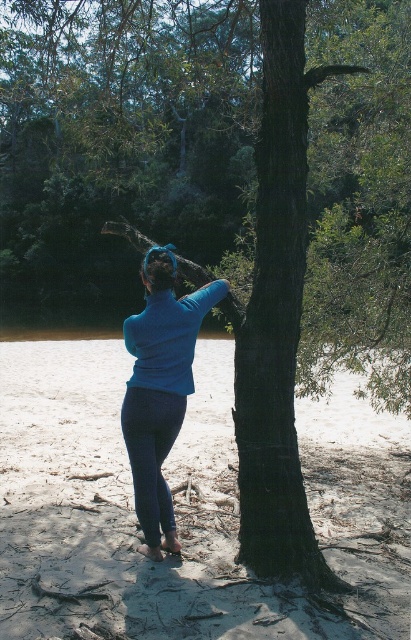
Is sandy textured sand at center thinner than blue matte leggings at center?

No.

Between sandy textured sand at center and blue matte leggings at center, which one is positioned lower?

sandy textured sand at center is lower down.

This screenshot has width=411, height=640. Identify the location of sandy textured sand at center. (184, 508).

Locate an element on the screen. sandy textured sand at center is located at coordinates (184, 508).